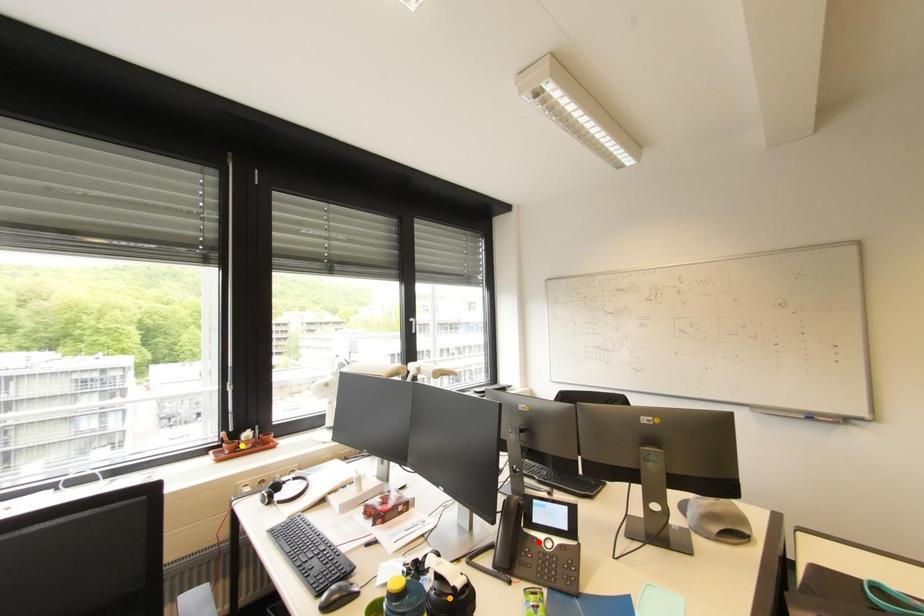
Order these from nearest to farthest:
yellow point, red point, orange point

1. orange point
2. red point
3. yellow point